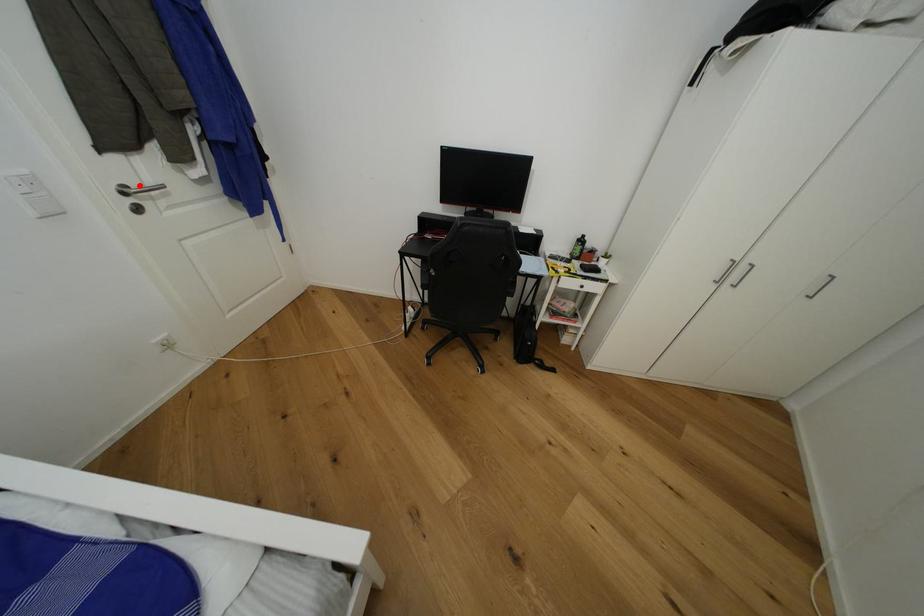
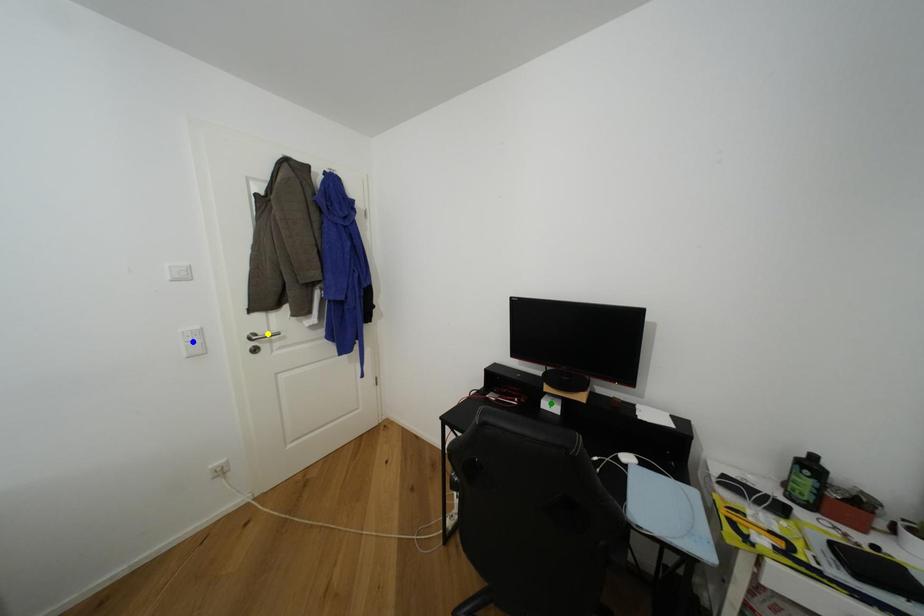
Question: I am providing you with two images of the same scene from different viewpoints. A red point is marked on the first image. You are given multiple points on the second image. Which mark in image 2 goes with the point in image 1?

Choices:
 (A) yellow point
 (B) blue point
 (C) green point

Answer: (A)